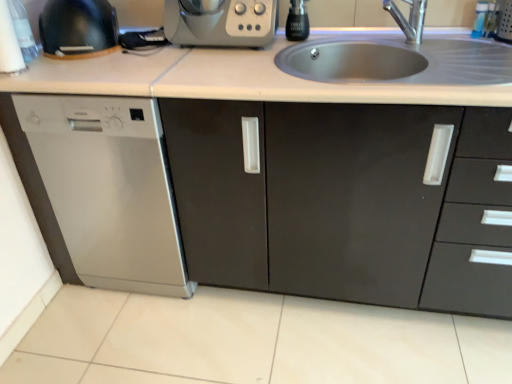
Question: Is stainless steel sink at upper center located outside matte black kettle at upper left, which is the 1th appliance in left-to-right order?

Choices:
 (A) no
 (B) yes

Answer: (B)

Question: Does stainless steel sink at upper center appear on the right side of matte black kettle at upper left, which is the 1th appliance in left-to-right order?

Choices:
 (A) no
 (B) yes

Answer: (B)

Question: From a real-world perspective, does stainless steel sink at upper center stand above matte black kettle at upper left, the second appliance when ordered from right to left?

Choices:
 (A) yes
 (B) no

Answer: (B)

Question: Is stainless steel sink at upper center taller than matte black kettle at upper left, which is the 1th appliance in left-to-right order?

Choices:
 (A) no
 (B) yes

Answer: (A)

Question: Can you confirm if stainless steel sink at upper center is wider than matte black kettle at upper left, the second appliance when ordered from right to left?

Choices:
 (A) yes
 (B) no

Answer: (A)

Question: Which is correct: matte black kettle at upper left, which is the 1th appliance in left-to-right order, is inside stainless steel sink at upper center, or outside of it?

Choices:
 (A) inside
 (B) outside

Answer: (B)

Question: From a real-world perspective, is matte black kettle at upper left, the second appliance when ordered from right to left, physically located above or below stainless steel sink at upper center?

Choices:
 (A) above
 (B) below

Answer: (A)

Question: Is matte black kettle at upper left, the second appliance when ordered from right to left, in front of or behind stainless steel sink at upper center in the image?

Choices:
 (A) front
 (B) behind

Answer: (B)

Question: Based on their sizes in the image, would you say matte black kettle at upper left, which is the 1th appliance in left-to-right order, is bigger or smaller than stainless steel sink at upper center?

Choices:
 (A) big
 (B) small

Answer: (A)

Question: From the image's perspective, relative to silver metallic faucet at upper center, is black glass bottle at upper center, the second appliance viewed from the left, above or below?

Choices:
 (A) below
 (B) above

Answer: (B)

Question: In terms of size, does black glass bottle at upper center, acting as the first appliance starting from the right, appear bigger or smaller than silver metallic faucet at upper center?

Choices:
 (A) small
 (B) big

Answer: (A)

Question: Is point (301, 16) positioned closer to the camera than point (420, 26)?

Choices:
 (A) farther
 (B) closer

Answer: (B)

Question: In the image, is black glass bottle at upper center, the second appliance viewed from the left, positioned in front of or behind silver metallic faucet at upper center?

Choices:
 (A) behind
 (B) front

Answer: (A)

Question: Is satin steel dishwasher at left taller or shorter than stainless steel sink at upper center?

Choices:
 (A) tall
 (B) short

Answer: (A)

Question: Based on their sizes in the image, would you say satin steel dishwasher at left is bigger or smaller than stainless steel sink at upper center?

Choices:
 (A) small
 (B) big

Answer: (B)